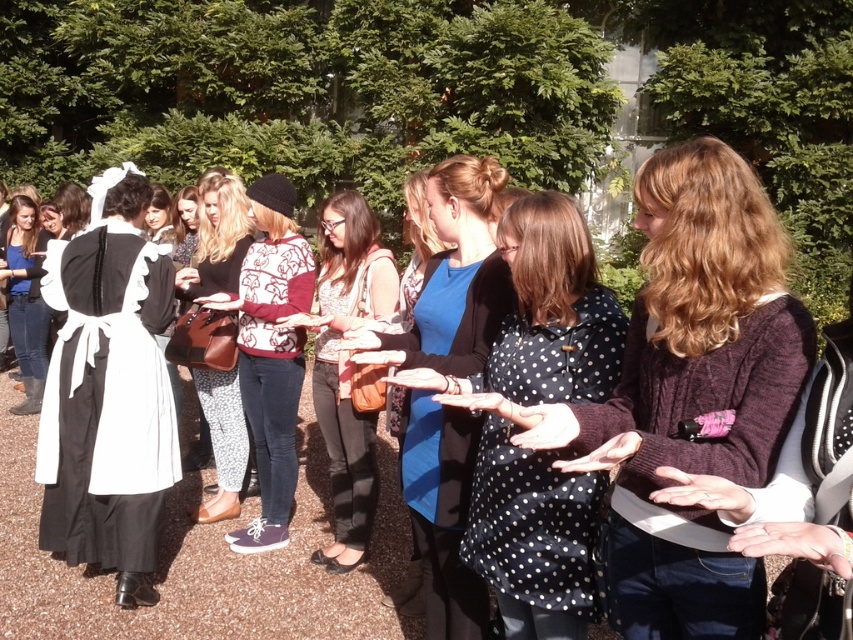
Question: Among these points, which one is nearest to the camera?

Choices:
 (A) (461, 460)
 (B) (372, 291)
 (C) (152, 284)
 (D) (572, 394)

Answer: (D)

Question: Considering the relative positions of black satin dress at left and white cotton apron at left in the image provided, where is black satin dress at left located with respect to white cotton apron at left?

Choices:
 (A) right
 (B) left

Answer: (A)

Question: Can you confirm if black polka dot dress at center is positioned to the right of white cotton apron at left?

Choices:
 (A) yes
 (B) no

Answer: (A)

Question: Which object appears closest to the camera in this image?

Choices:
 (A) blue fabric dress at center
 (B) knit sweater at center
 (C) dark brown sweater at center

Answer: (C)

Question: Which point is closer to the camera taking this photo?

Choices:
 (A) (10, 326)
 (B) (183, 282)

Answer: (B)

Question: Is blue fabric dress at center to the left of white cotton apron at left from the viewer's perspective?

Choices:
 (A) yes
 (B) no

Answer: (B)